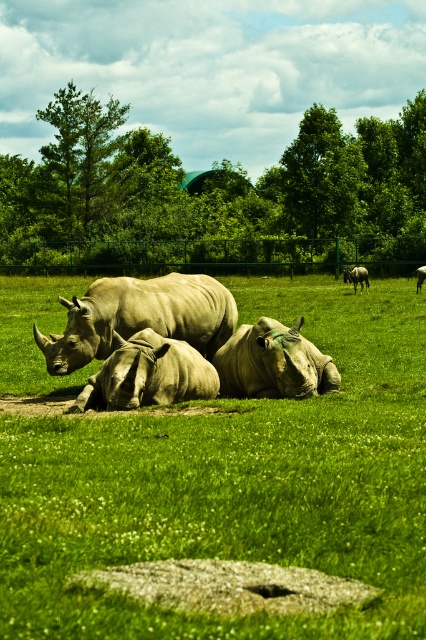
Question: Which object is positioned farthest from the green leafy tree at upper center?

Choices:
 (A) smooth beige rhino at center
 (B) gray matte rhinoceros at center
 (C) smooth gray rhino at center

Answer: (A)

Question: Among these objects, which one is nearest to the camera?

Choices:
 (A) smooth beige rhino at center
 (B) green leafy tree at upper center
 (C) gray matte rhinoceros at center
 (D) green leafy tree at upper left

Answer: (C)

Question: Can you confirm if grayish-brown rhino at center is positioned to the left of matte gray rhino at center?

Choices:
 (A) yes
 (B) no

Answer: (A)

Question: Which object is closer to the camera taking this photo?

Choices:
 (A) green leafy tree at upper center
 (B) light gray matte rhino at right

Answer: (B)

Question: Is green leafy tree at upper left further to the viewer compared to matte gray rhino at center?

Choices:
 (A) no
 (B) yes

Answer: (B)

Question: Can you confirm if grayish-brown rhino at center is positioned above green leafy tree at upper center?

Choices:
 (A) yes
 (B) no

Answer: (B)